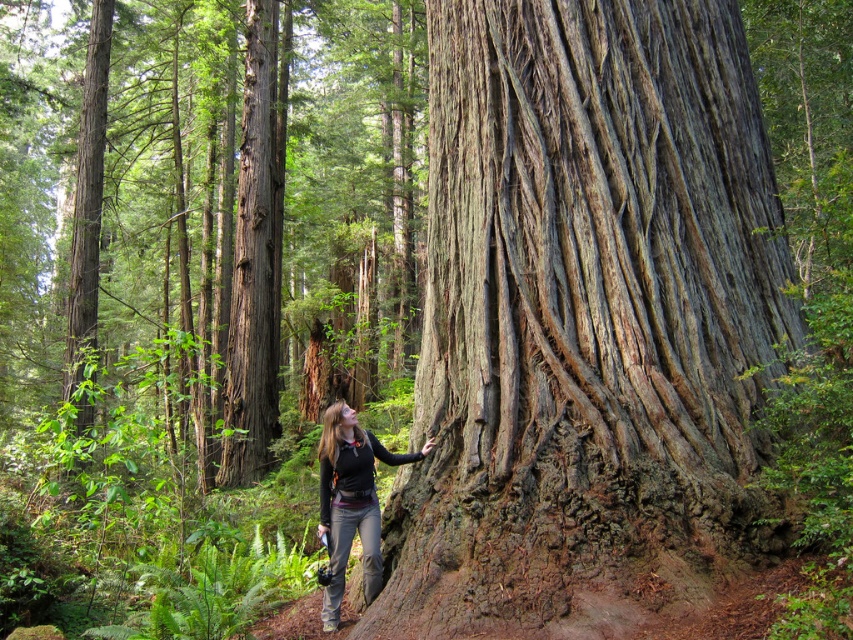
You are a squirrel trying to climb the massive tree trunk. You see the point at coordinates [256,253] on the tree. Is this point located on the rough bark or the smooth brown bark at center?

The point at coordinates [256,253] is on the smooth brown bark at center, so it is located on the smooth area.

You are standing in the forest and want to touch the rough bark tree trunk at center. Which direction should you move to reach it?

Since the rough bark tree trunk at center is located at point coordinates of (589, 323), you should move towards the center of the scene to reach it.

You are an explorer in the forest and want to touch the smooth brown bark at center and the matte black jacket at center. Which object is closer to your hand when you reach out?

The smooth brown bark at center is positioned over the matte black jacket at center, so the smooth brown bark at center is closer to your hand when you reach out.